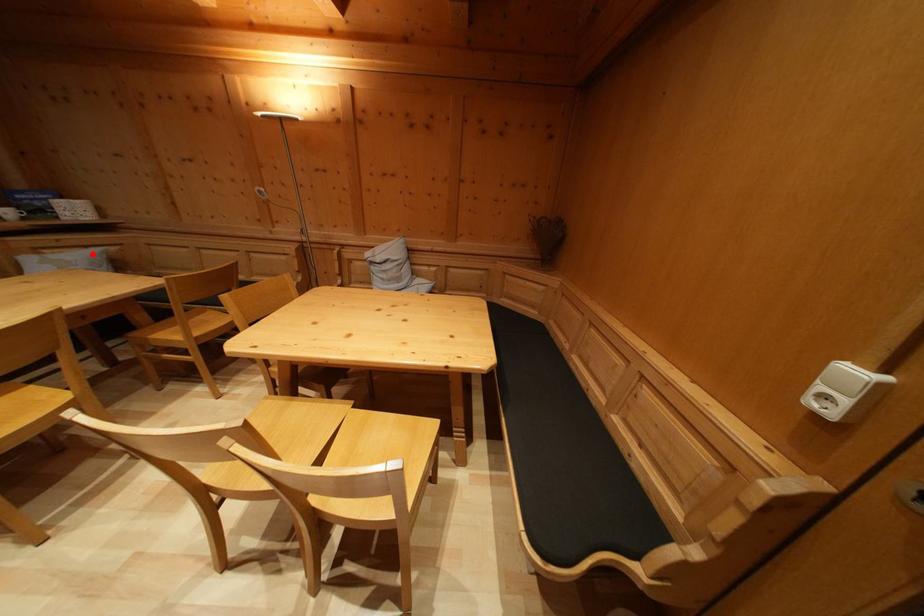
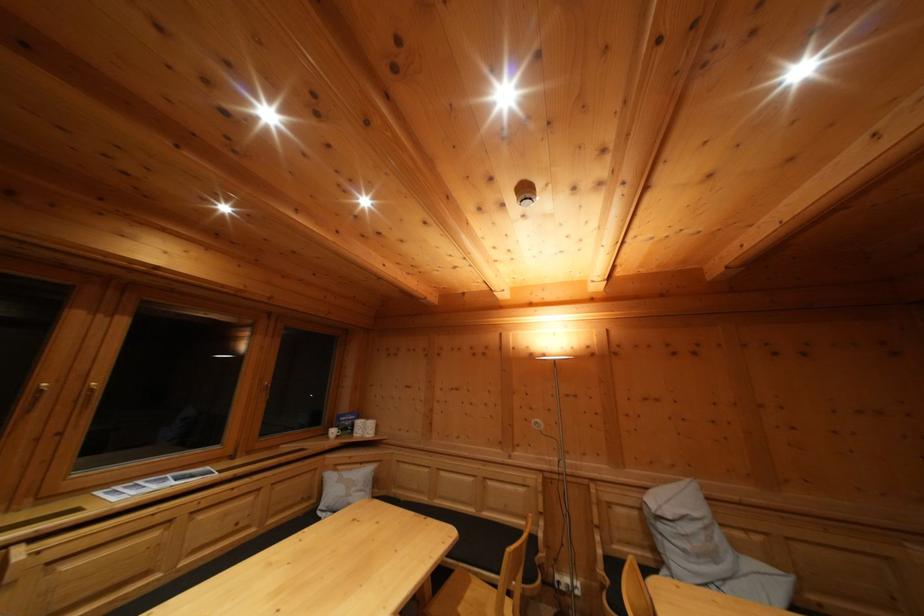
Locate, in the second image, the point that corresponds to the highlighted location in the first image.

(368, 469)